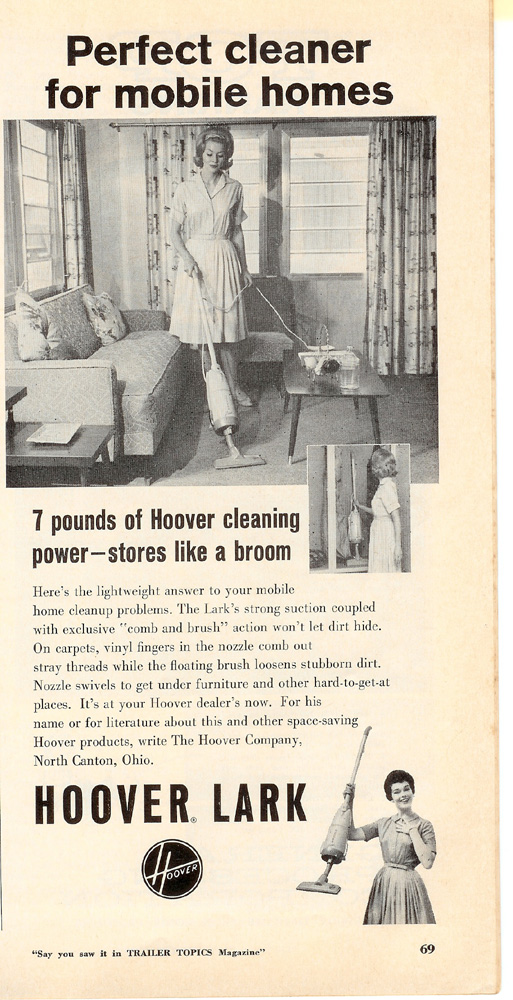
Locate an element on the screen. coffee table is located at coordinates (373, 387).